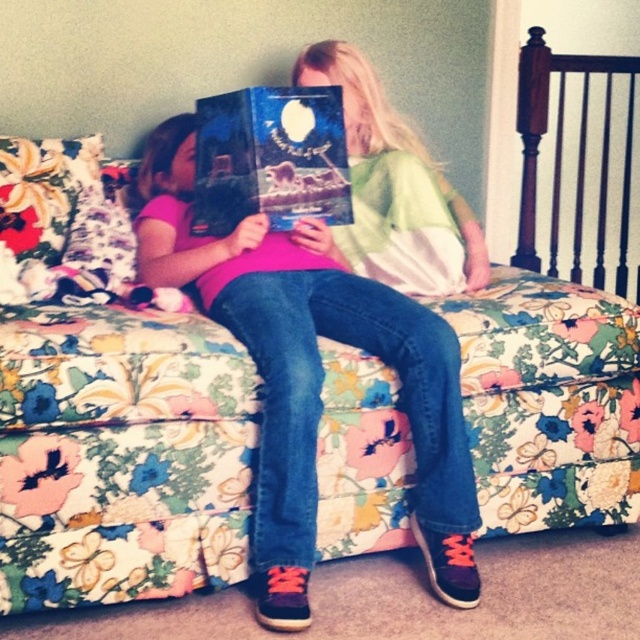
Is pink matte shirt at center shorter than hardcover book at center?

In fact, pink matte shirt at center may be taller than hardcover book at center.

Is pink matte shirt at center wider than hardcover book at center?

Indeed, pink matte shirt at center has a greater width compared to hardcover book at center.

Identify the location of pink matte shirt at center. tap(312, 372).